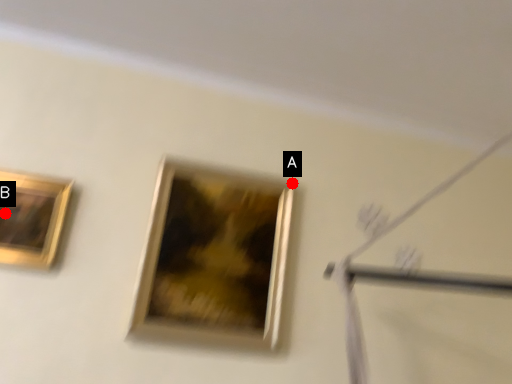
Question: Two points are circled on the image, labeled by A and B beside each circle. Which of the following is the closest to the observer?

Choices:
 (A) A is closer
 (B) B is closer

Answer: (B)